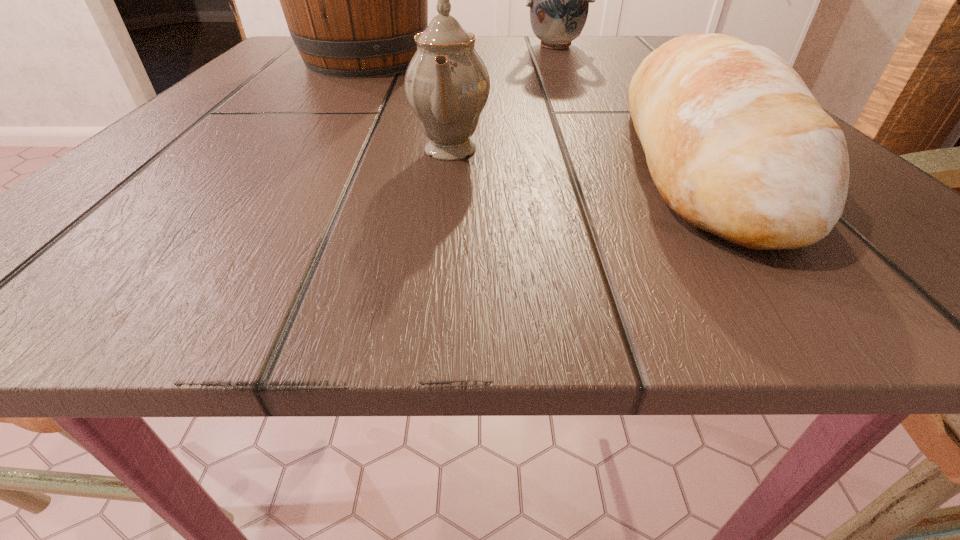
Identify the location of the leftmost object. (353, 0).

Find the location of a particular element. cider is located at coordinates (353, 0).

Where is `the second tallest object`? the second tallest object is located at coordinates (559, 0).

Image resolution: width=960 pixels, height=540 pixels. I want to click on the third object from right to left, so click(x=447, y=84).

Locate an element on the screen. the third tallest object is located at coordinates (447, 84).

I want to click on the shortest object, so click(x=737, y=145).

Locate an element on the screen. free space located 0.170m on the right of the cider is located at coordinates (526, 60).

Locate an element on the screen. This screenshot has height=540, width=960. free space located on either side of the third shortest object is located at coordinates point(585,106).

Find the location of `vacant space located 0.070m on the spout of the second object from left to right`. vacant space located 0.070m on the spout of the second object from left to right is located at coordinates (548, 150).

Where is `vacant position located 0.100m on the left of the bread`? vacant position located 0.100m on the left of the bread is located at coordinates (535, 159).